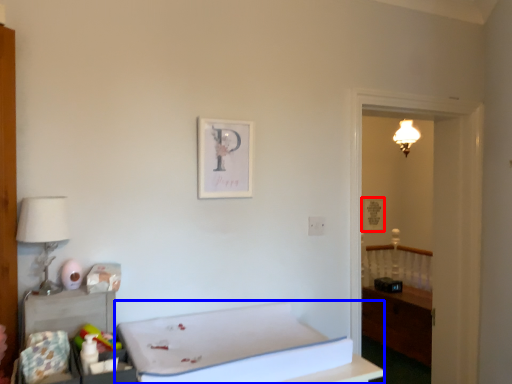
Question: Which point is closer to the camera, picture frame (highlighted by a red box) or furniture (highlighted by a blue box)?

Choices:
 (A) picture frame
 (B) furniture

Answer: (B)